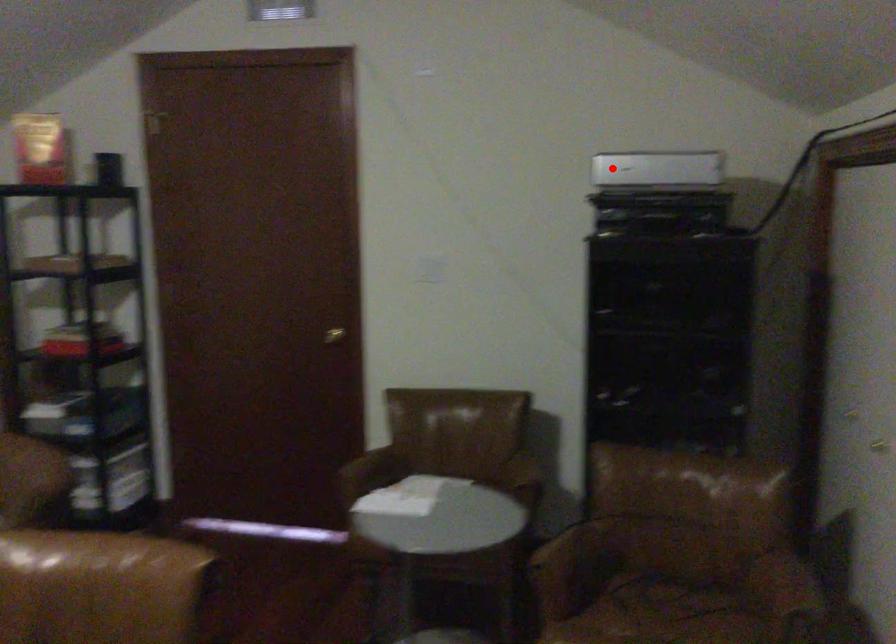
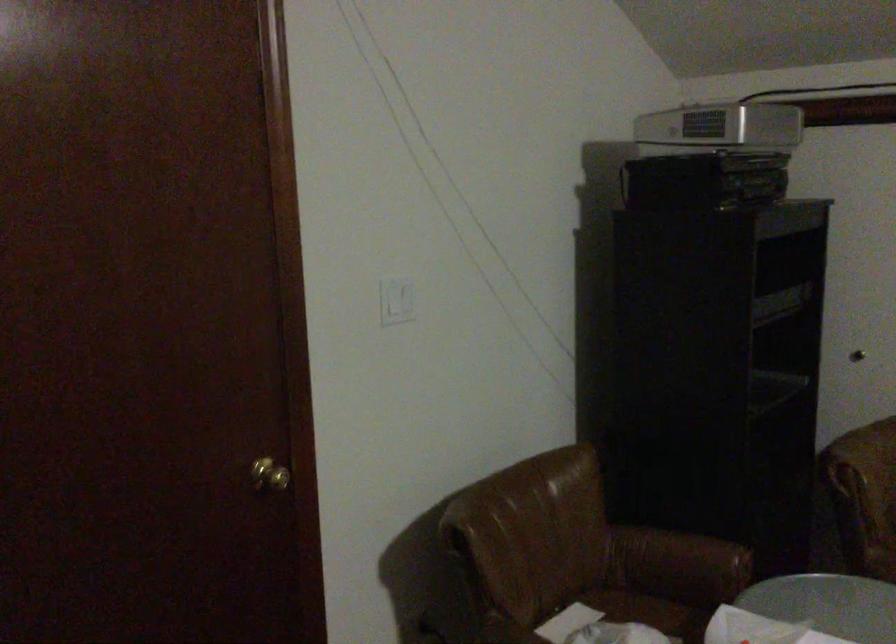
Find the pixel in the second image that matches the highlighted location in the first image.

(719, 129)